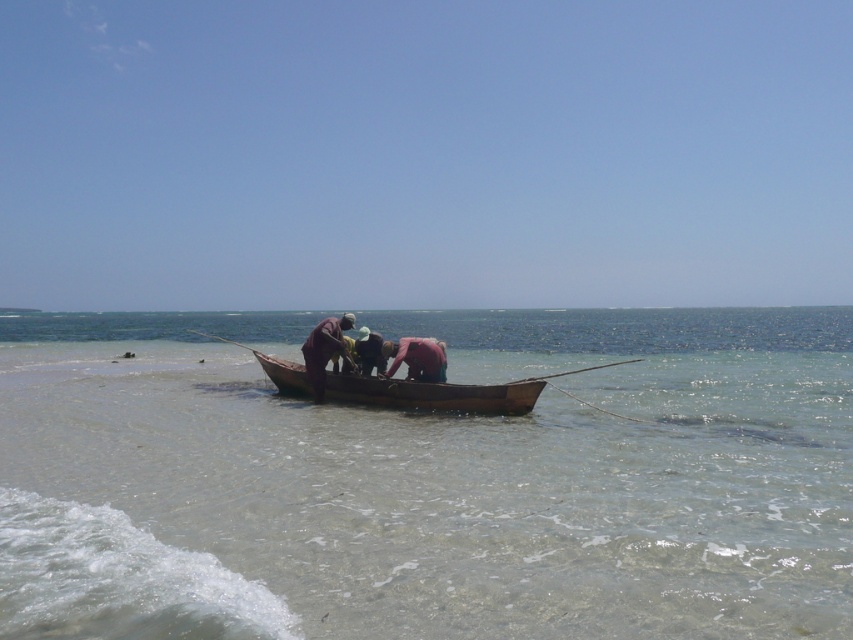
In the scene shown: You are standing on the beach and see two points in the water. The first point is at coordinates point (x=126, y=429) and the second is at point (x=364, y=330). Which point is closer to the shore?

Point (x=126, y=429) is in front of point (x=364, y=330), so it is closer to the shore.

In the scene shown: You are planning to place a small floating dock on the water. The dock requires a space wider than the smooth pink fabric at center. Based on the scene, can the clear water at boat center provide enough width for the dock?

The clear water at boat center has a larger width than the smooth pink fabric at center, so it can accommodate the dock.